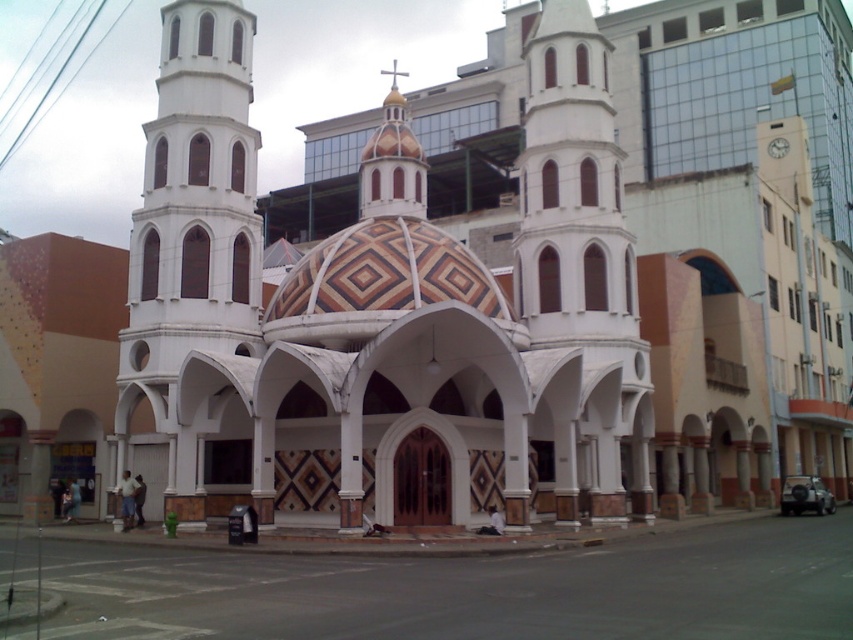
Can you confirm if white marble tower at center is positioned below white smooth tower at center?

No, white marble tower at center is not below white smooth tower at center.

Is point (537, 269) in front of point (117, 445)?

That is True.

Find the location of a particular element. white marble tower at center is located at coordinates (579, 273).